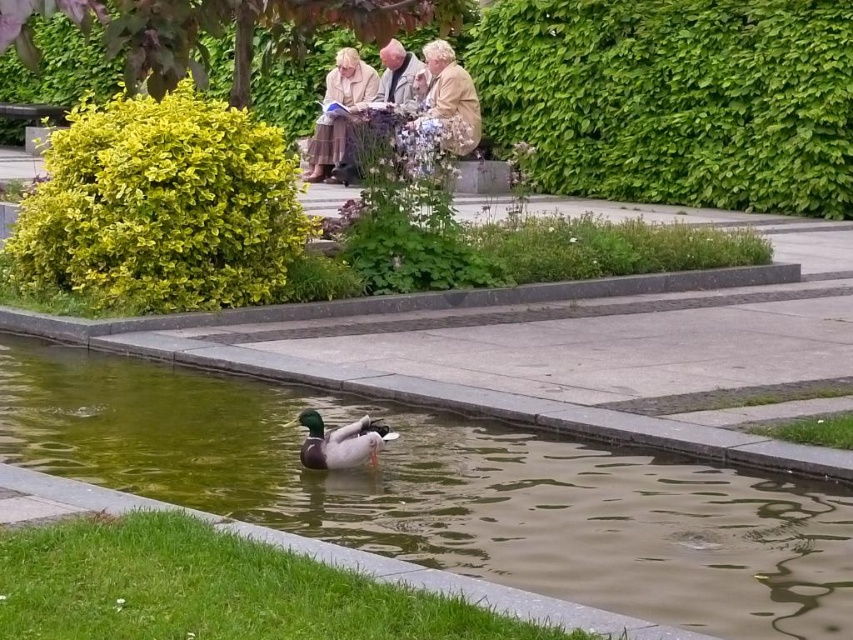
Is greenish water at duck center behind light beige fabric coat at upper center?

No, it is not.

Is point (587, 604) farther from viewer compared to point (405, 51)?

No, it is not.

I want to click on greenish water at duck center, so pyautogui.click(x=450, y=492).

Does light beige fabric coat at upper center have a greater height compared to green glossy duck at center?

Yes.

Is light beige fabric coat at upper center below green glossy duck at center?

Incorrect, light beige fabric coat at upper center is not positioned below green glossy duck at center.

Which is in front, point (457, 116) or point (306, 438)?

Point (306, 438) is more forward.

You are a GUI agent. You are given a task and a screenshot of the screen. Output one action in this format:
    pyautogui.click(x=<x>, y=<y>)
    Task: Click on the light beige fabric coat at upper center
    The width and height of the screenshot is (853, 640).
    Given the screenshot: What is the action you would take?
    pyautogui.click(x=403, y=108)

Identify the location of greenish water at duck center. The image size is (853, 640). (450, 492).

Can you confirm if greenish water at duck center is positioned to the left of light beige fabric jacket at upper center?

No, greenish water at duck center is not to the left of light beige fabric jacket at upper center.

Does point (45, 440) lie behind point (462, 72)?

No, (45, 440) is in front of (462, 72).

The image size is (853, 640). What are the coordinates of `greenish water at duck center` in the screenshot? It's located at pos(450,492).